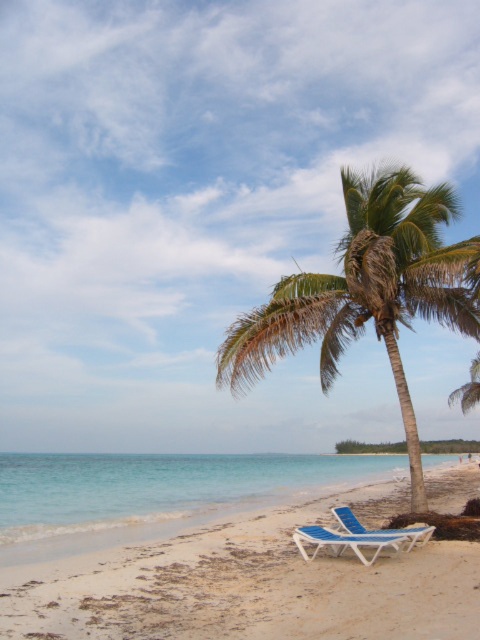
From the picture: You are standing at the shoreline and want to walk towards the palm tree. There are two points marked on the sand, point A at coordinates point(319, 589) and point B at coordinates point(336, 513). Which point should you step on first if you need to follow the path that goes directly towards the palm tree?

Point A at coordinates point(319, 589) should be stepped on first because it is in front of point B at coordinates point(336, 513) along the path towards the palm tree.

Consider the image. You are a beachgoer who wants to set up an umbrella on the white sandy beach at lower center. However, there is already a blue plastic beach chair at lower center in the way. Can you place the umbrella in the same area without moving the chair?

The white sandy beach at lower center is located below the blue plastic beach chair at lower center, which means the chair is positioned on top of the beach area. Therefore, you can place the umbrella in the same area by positioning it next to or behind the chair, as the beach extends below the chair.